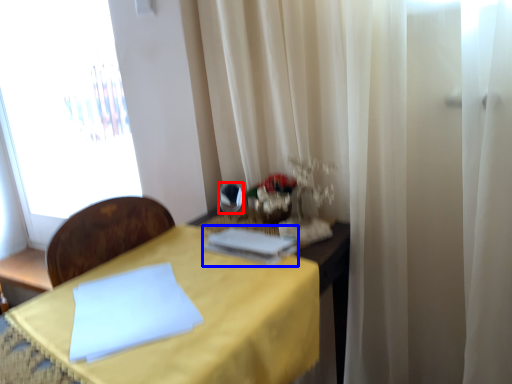
Question: Which point is further to the camera, mirror (highlighted by a red box) or book (highlighted by a blue box)?

Choices:
 (A) mirror
 (B) book

Answer: (A)